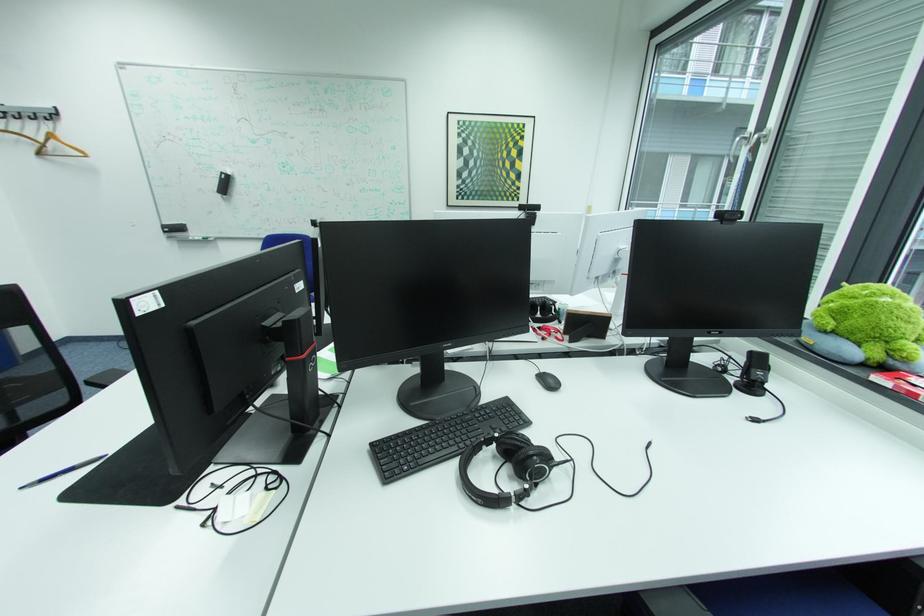
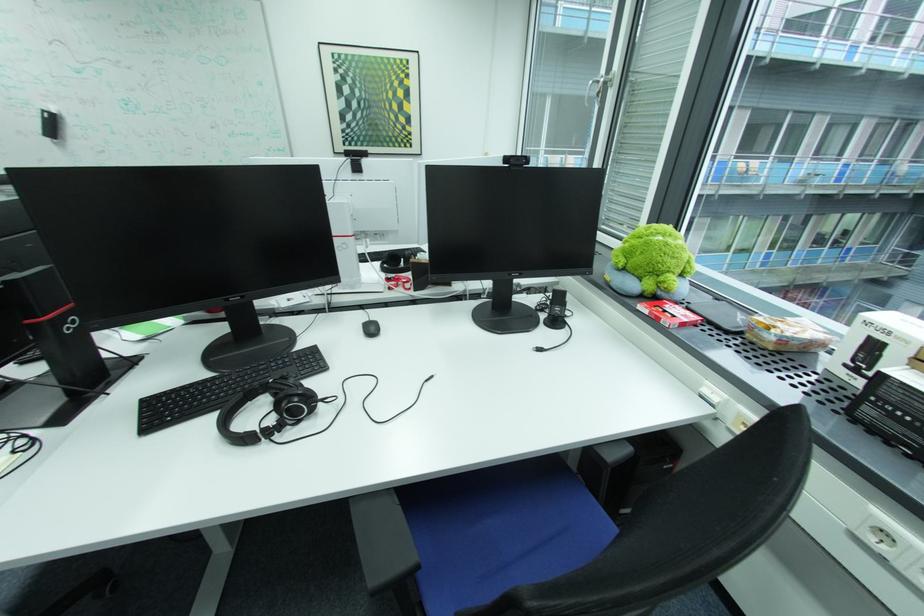
Locate, in the second image, the point that corresponds to (x=307, y=362) in the first image.

(47, 323)